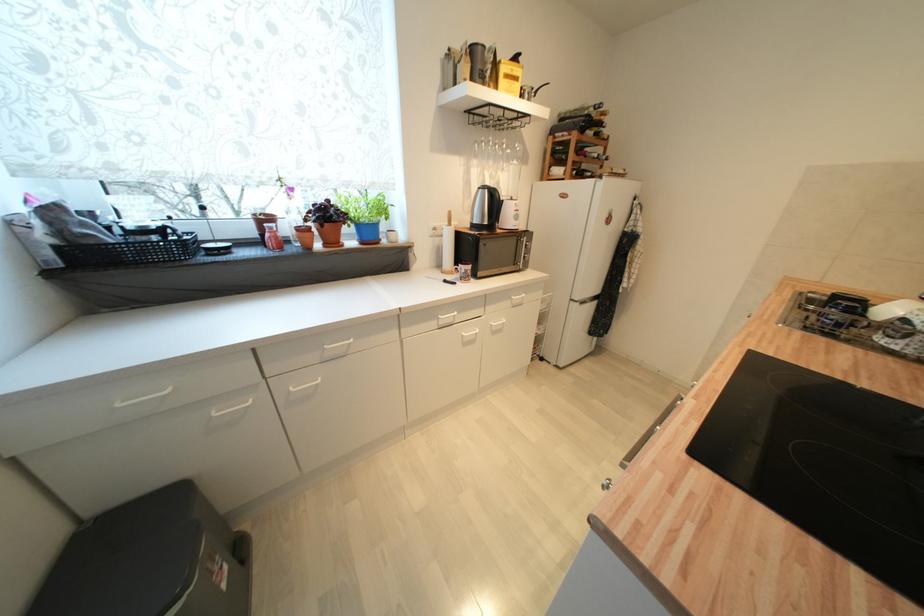
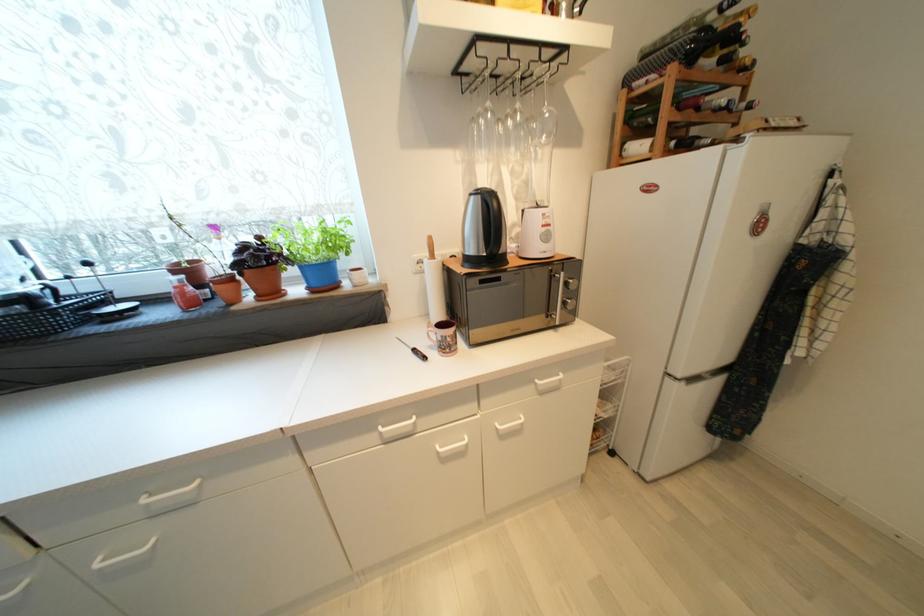
Question: The images are taken continuously from a first-person perspective. In which direction is your viewpoint rotating?

Choices:
 (A) Left
 (B) Right
 (C) Up
 (D) Down

Answer: (A)